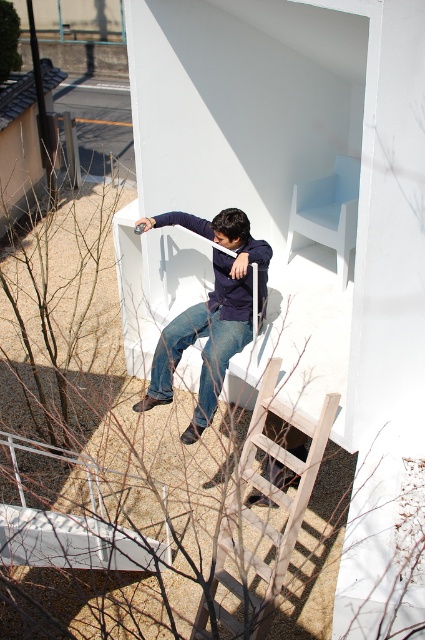
Question: Is matte blue jeans at center to the right of wooden ladder at lower center from the viewer's perspective?

Choices:
 (A) no
 (B) yes

Answer: (A)

Question: Among these objects, which one is nearest to the camera?

Choices:
 (A) matte blue jeans at center
 (B) white matte chair at upper center
 (C) blue denim jeans at lower center
 (D) wooden ladder at lower center

Answer: (D)

Question: Which of the following is the closest to the observer?

Choices:
 (A) blue denim jeans at lower center
 (B) matte blue jeans at center
 (C) white matte chair at upper center

Answer: (B)

Question: Which point is closer to the camera?

Choices:
 (A) (243, 513)
 (B) (309, 198)
 (C) (212, 349)

Answer: (A)

Question: Is matte blue jeans at center positioned before blue denim jeans at lower center?

Choices:
 (A) yes
 (B) no

Answer: (A)

Question: Does matte blue jeans at center have a larger size compared to white matte chair at upper center?

Choices:
 (A) no
 (B) yes

Answer: (B)